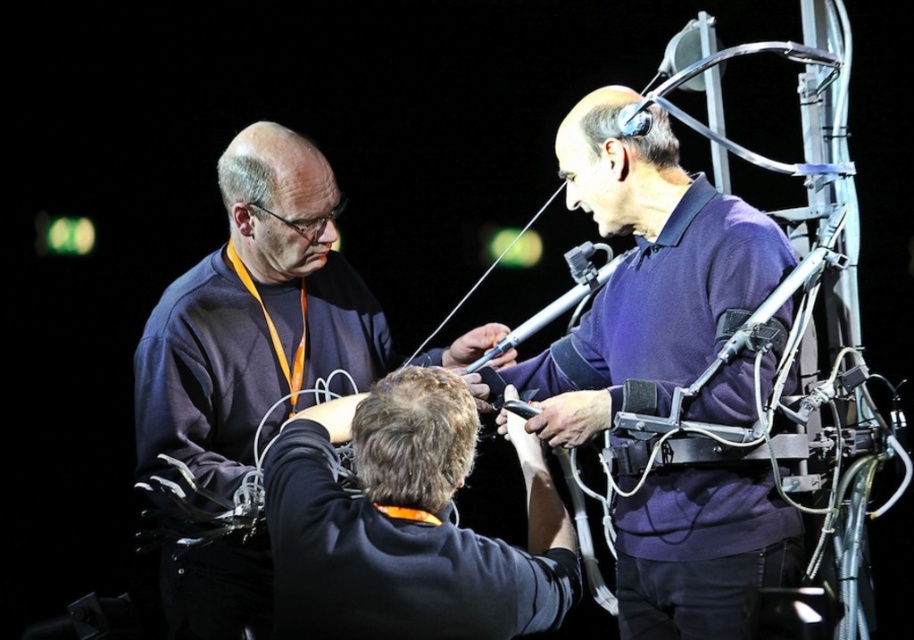
You are standing in the room and see two points marked on the equipment. Which point is closer to you, point (254, 204) or point (351, 424)?

Point (351, 424) is closer to you because it is less further to the camera than point (254, 204).

You are a new intern in the lab and need to identify the person wearing the purple matte shirt at center and the dark blue sweatshirt at center. According to the scene description, which of these two individuals is standing higher in the image?

The purple matte shirt at center is located above the dark blue sweatshirt at center, so the person wearing the purple matte shirt at center is standing higher in the image.

You are a security guard in the facility and need to identify which person is closer to the entrance located at the back of the room. The entrance is behind the equipment. Which person should you approach first, the one wearing the dark blue sweatshirt at center or the one in the black matte jacket at center?

The black matte jacket at center is behind the dark blue sweatshirt at center, so the dark blue sweatshirt at center is closer to the entrance located at the back of the room. Therefore, you should approach the dark blue sweatshirt at center first.